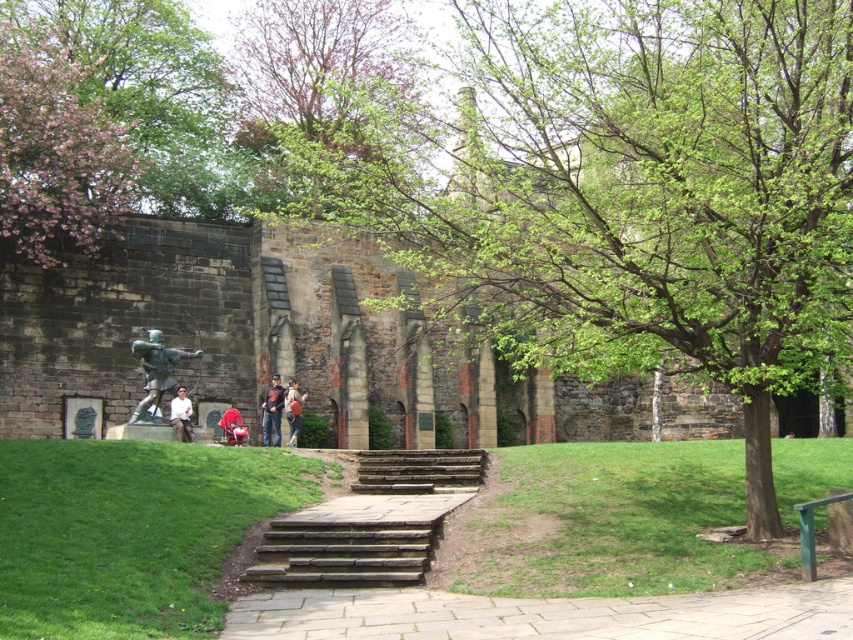
Question: Can you confirm if green grass at lower left is positioned below paved stone path at center?

Choices:
 (A) yes
 (B) no

Answer: (B)

Question: Can you confirm if white shirt at lower left is wider than denim jacket at center?

Choices:
 (A) no
 (B) yes

Answer: (A)

Question: Observing the image, what is the correct spatial positioning of green leafy tree at center in reference to paved stone path at center?

Choices:
 (A) left
 (B) right

Answer: (B)

Question: Which object is farther from the camera taking this photo?

Choices:
 (A) brown stone stairs at center
 (B) green grass at lower right
 (C) white shirt at lower left

Answer: (C)

Question: Which object is farther from the camera taking this photo?

Choices:
 (A) pink blossoms at upper left
 (B) green leafy tree at upper center
 (C) green leafy tree at center

Answer: (A)

Question: Which object is positioned farthest from the green grass at lower right?

Choices:
 (A) denim jacket at center
 (B) white shirt at lower left
 (C) green leafy tree at upper center

Answer: (C)